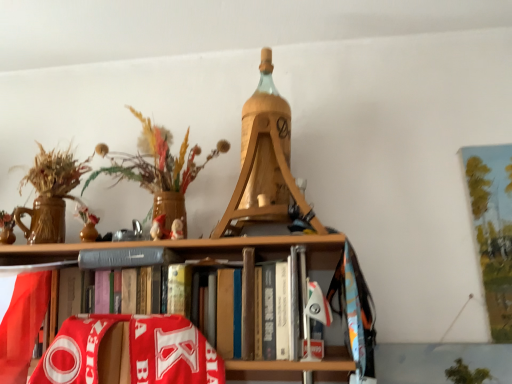
What do you see at coordinates (120, 257) in the screenshot? I see `gray matte book at center` at bounding box center [120, 257].

Consider the image. What is the approximate width of wooden vase with dried flowers at upper left?

The width of wooden vase with dried flowers at upper left is 33.50 centimeters.

The width and height of the screenshot is (512, 384). What are the coordinates of `gray matte book at center` in the screenshot? It's located at (120, 257).

From the image's perspective, is wooden vase with dried flowers at upper left over hardcover book at center?

Yes, from the image's perspective, wooden vase with dried flowers at upper left is over hardcover book at center.

Is there a large distance between wooden vase with dried flowers at upper left and hardcover book at center?

That's not correct — wooden vase with dried flowers at upper left is a little close to hardcover book at center.

Locate an element on the screen. This screenshot has width=512, height=384. floral arrangement that appears behind the hardcover book at center is located at coordinates (160, 169).

Based on the photo, does wooden vase with dried flowers at upper left appear on the left side of hardcover book at center?

Incorrect, wooden vase with dried flowers at upper left is not on the left side of hardcover book at center.

Which of these two, hardcover book at center or wooden vase with dried flowers at upper left, is smaller?

With smaller size is wooden vase with dried flowers at upper left.

From a real-world perspective, is hardcover book at center beneath wooden vase with dried flowers at upper left?

Yes, from a real-world perspective, hardcover book at center is beneath wooden vase with dried flowers at upper left.

The height and width of the screenshot is (384, 512). What are the coordinates of `book below the wooden vase with dried flowers at upper left (from the image's perspective)` in the screenshot? It's located at (111, 258).

Does gray matte book at center lie behind hardcover book at center?

That is True.

Is gray matte book at center oriented towards hardcover book at center?

Yes, gray matte book at center is facing hardcover book at center.

Does gray matte book at center appear on the left side of hardcover book at center?

No, gray matte book at center is not to the left of hardcover book at center.

Is gray matte book at center not near hardcover book at center?

gray matte book at center is near hardcover book at center, not far away.

From the image's perspective, relative to wooden vase with dried flowers at upper left, is gray matte book at center above or below?

Clearly, from the image's perspective, gray matte book at center is below wooden vase with dried flowers at upper left.

Is gray matte book at center oriented away from wooden vase with dried flowers at upper left?

No, wooden vase with dried flowers at upper left is not at the back of gray matte book at center.

Consider the image. Is gray matte book at center next to wooden vase with dried flowers at upper left and touching it?

There is a gap between gray matte book at center and wooden vase with dried flowers at upper left.

From a real-world perspective, is hardcover book at center positioned under gray matte book at center based on gravity?

Indeed, from a real-world perspective, hardcover book at center is positioned beneath gray matte book at center.

Is hardcover book at center not close to gray matte book at center?

No, hardcover book at center is in close proximity to gray matte book at center.

Who is bigger, hardcover book at center or gray matte book at center?

Bigger between the two is hardcover book at center.

Is hardcover book at center positioned before gray matte book at center?

Yes, hardcover book at center is in front of gray matte book at center.

From the picture: Is wooden vase with dried flowers at upper left in front of or behind gray matte book at center in the image?

wooden vase with dried flowers at upper left is positioned closer to the viewer than gray matte book at center.

Consider the image. How much distance is there between wooden vase with dried flowers at upper left and gray matte book at center?

wooden vase with dried flowers at upper left is 9.27 inches away from gray matte book at center.

Can you confirm if wooden vase with dried flowers at upper left is wider than gray matte book at center?

Yes.

How many degrees apart are the facing directions of wooden vase with dried flowers at upper left and gray matte book at center?

wooden vase with dried flowers at upper left and gray matte book at center are facing 0.642 degrees away from each other.

Identify the location of book below the wooden vase with dried flowers at upper left (from the image's perspective). (x=111, y=258).

Locate an element on the screen. The height and width of the screenshot is (384, 512). book that is under the wooden vase with dried flowers at upper left (from a real-world perspective) is located at coordinates (111, 258).

From the image, which object appears to be nearer to hardcover book at center, wooden vase with dried flowers at upper left or gray matte book at center?

The object closer to hardcover book at center is gray matte book at center.

Based on their spatial positions, is gray matte book at center or hardcover book at center further from wooden vase with dried flowers at upper left?

hardcover book at center lies further to wooden vase with dried flowers at upper left than the other object.

Estimate the real-world distances between objects in this image. Which object is further from gray matte book at center, hardcover book at center or wooden vase with dried flowers at upper left?

wooden vase with dried flowers at upper left is further to gray matte book at center.

Estimate the real-world distances between objects in this image. Which object is further from wooden vase with dried flowers at upper left, hardcover book at center or gray matte book at center?

hardcover book at center is positioned further to the anchor wooden vase with dried flowers at upper left.

Based on the photo, looking at the image, which one is located further to hardcover book at center, gray matte book at center or wooden vase with dried flowers at upper left?

wooden vase with dried flowers at upper left.

When comparing their distances from gray matte book at center, does wooden vase with dried flowers at upper left or hardcover book at center seem closer?

hardcover book at center is positioned closer to the anchor gray matte book at center.

This screenshot has width=512, height=384. I want to click on paperback book between wooden vase with dried flowers at upper left and hardcover book at center vertically, so [120, 257].